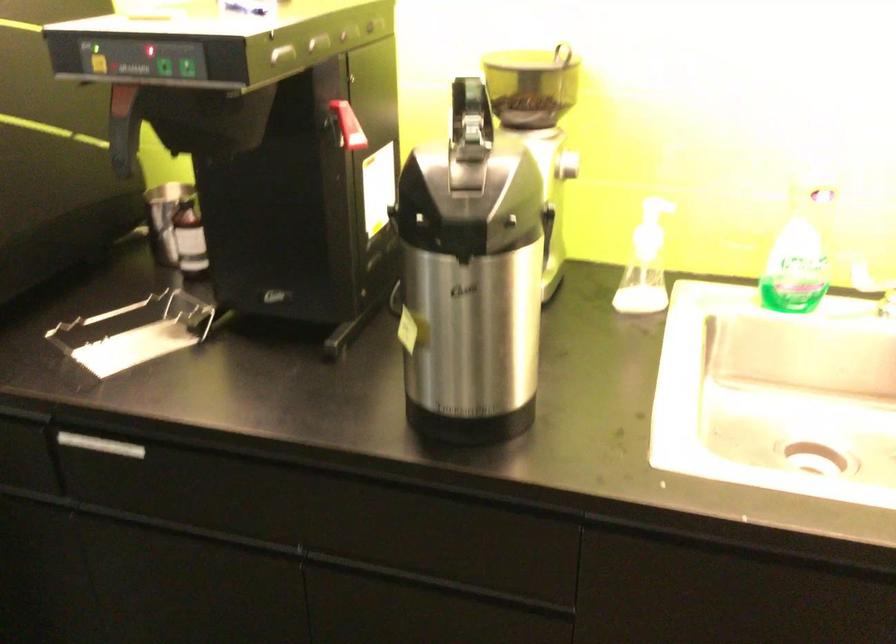
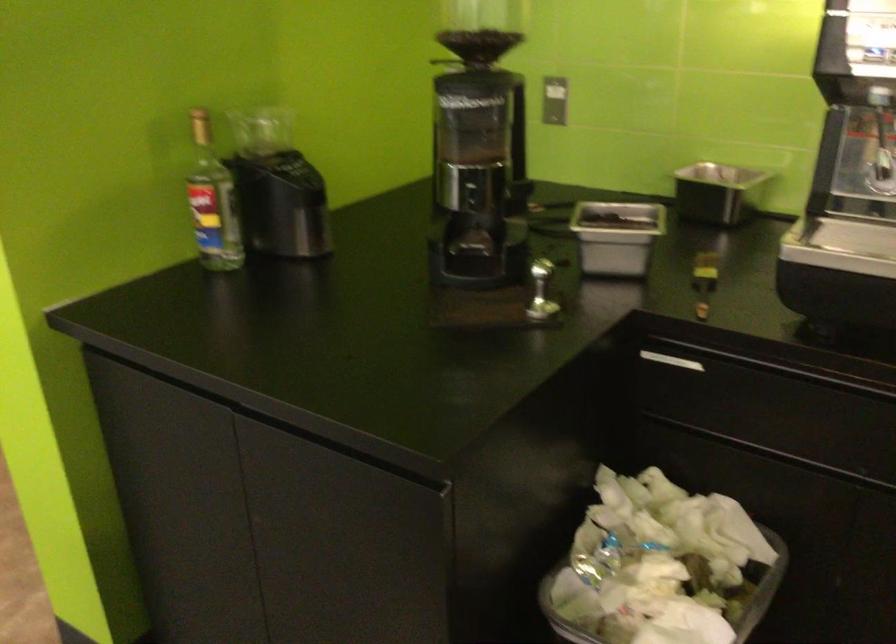
Question: What movement of the cameraman would produce the second image?

Choices:
 (A) Left
 (B) Right
 (C) Forward
 (D) Backward

Answer: (A)